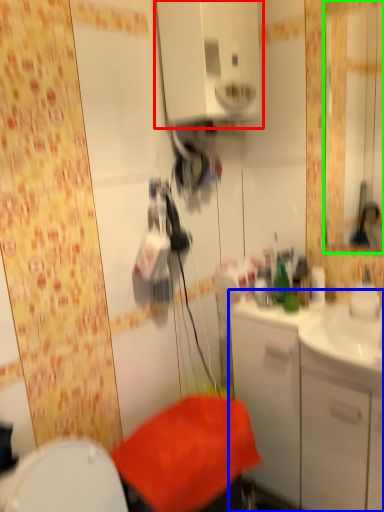
Question: Which object is the closest to the medicine cabinet (highlighted by a red box)? Choose among these: bathroom cabinet (highlighted by a blue box) or mirror (highlighted by a green box).

Choices:
 (A) bathroom cabinet
 (B) mirror

Answer: (A)